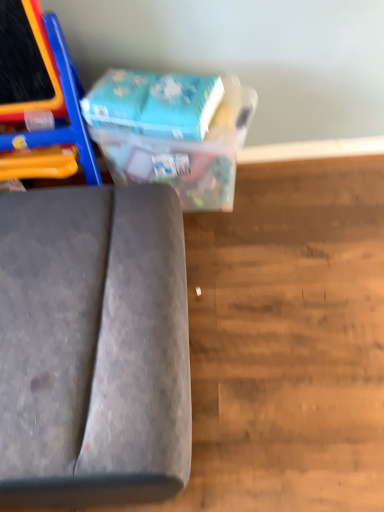
The image size is (384, 512). In order to click on free space above blue cardboard box at upper center (from a real-world perspective) in this screenshot , I will do `click(144, 88)`.